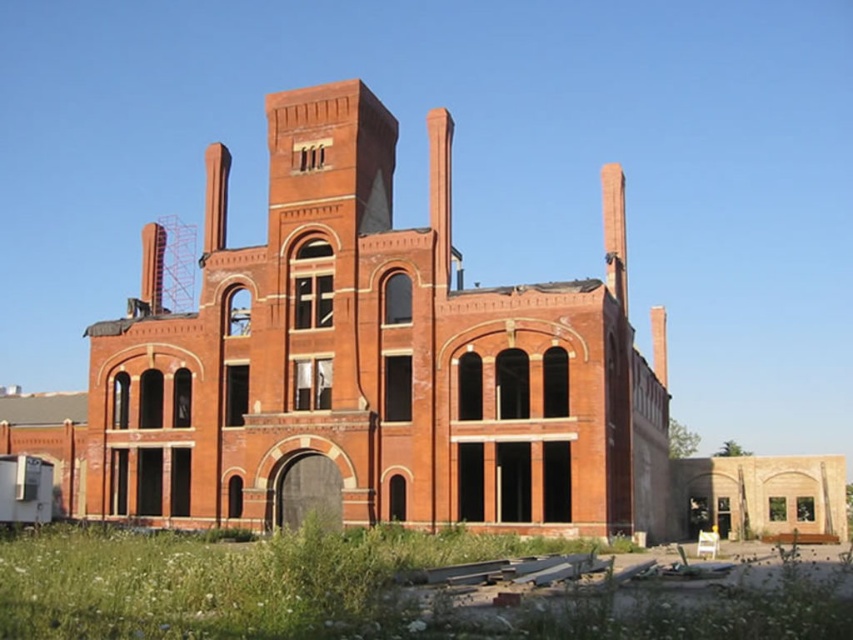
Who is positioned more to the left, red brick building at center or green grass at lower left?

green grass at lower left

Can you confirm if red brick building at center is positioned above green grass at lower left?

Yes, red brick building at center is above green grass at lower left.

Is point (477, 417) positioned behind point (51, 612)?

Yes, it is.

Image resolution: width=853 pixels, height=640 pixels. Find the location of `red brick building at center`. red brick building at center is located at coordinates (374, 362).